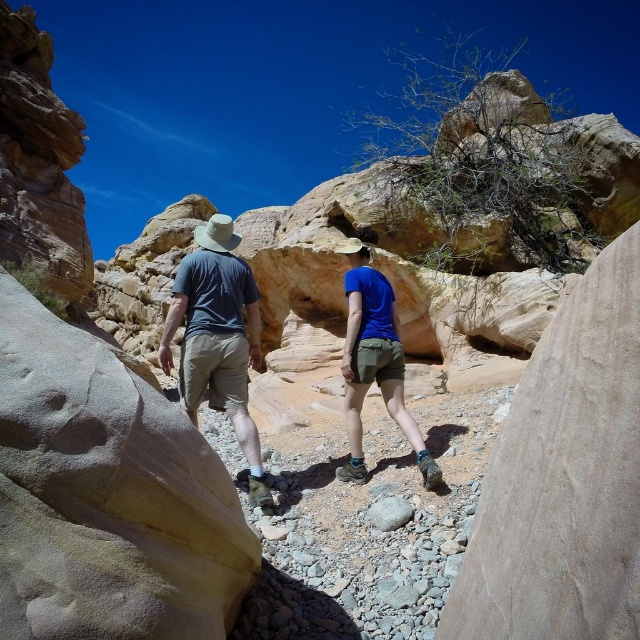
Question: Estimate the real-world distances between objects in this image. Which object is closer to the blue fabric shorts at center?

Choices:
 (A) smooth gray rock at center
 (B) matte gray shirt at center
 (C) matte khaki shorts at center

Answer: (C)

Question: Which object appears farthest from the camera in this image?

Choices:
 (A) matte khaki shorts at center
 (B) matte gray shirt at center
 (C) blue fabric shorts at center
 (D) smooth gray rock at center

Answer: (B)

Question: Considering the relative positions of matte khaki shorts at center and smooth gray rock at center in the image provided, where is matte khaki shorts at center located with respect to smooth gray rock at center?

Choices:
 (A) below
 (B) above

Answer: (B)

Question: Which object is the farthest from the smooth gray rock at center?

Choices:
 (A) matte khaki shorts at center
 (B) matte gray shirt at center
 (C) blue fabric shorts at center

Answer: (B)

Question: Does blue fabric shorts at center appear over smooth gray rock at center?

Choices:
 (A) yes
 (B) no

Answer: (A)

Question: Does matte khaki shorts at center have a greater width compared to blue fabric shorts at center?

Choices:
 (A) no
 (B) yes

Answer: (B)